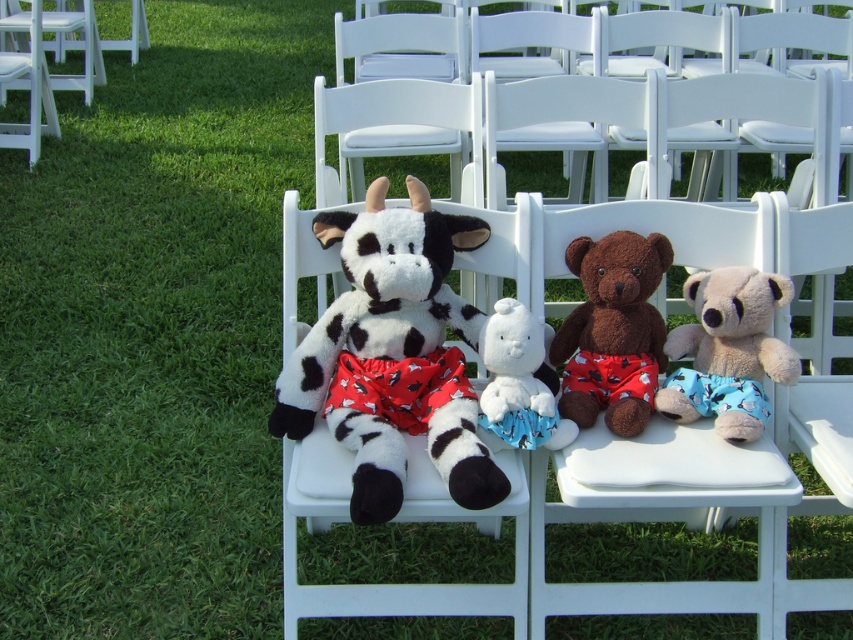
You are organizing a childrens picnic and see the fluffy blue teddy bear at center right and the white plush rabbit at center. Which plush toy is positioned more to the right side?

The fluffy blue teddy bear at center right is positioned more to the right side than the white plush rabbit at center.

You are standing at the point marked by the coordinates (614, 324) in the image. Looking around, you see a row of white folding chairs extending into the distance. Which direction should you face to see the brown plush teddy bear at center?

The point marked by the coordinates (614, 324) is exactly where the brown plush teddy bear at center is located, so you are already facing it.

You are standing in front of the row of white folding chairs and notice two points marked on the ground. The first point is at coordinates point [650,380] and the second point is at coordinates point [654,406]. Which point is closer to you?

Point [650,380] is closer to you because it is further to the camera than point [654,406].